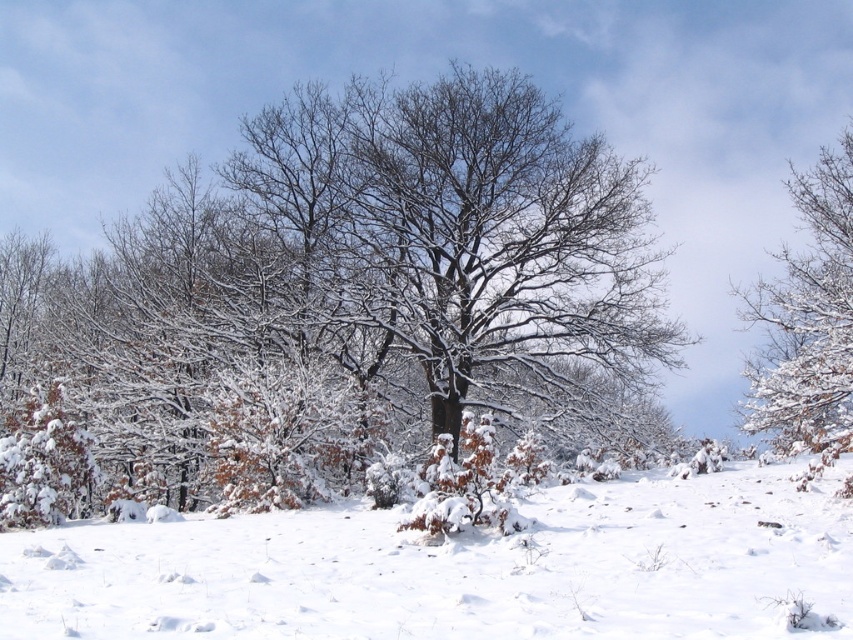
Is white fluffy snow at center positioned behind white snow-covered tree at right?

No, it is in front of white snow-covered tree at right.

Looking at this image, between white fluffy snow at center and white snow-covered tree at right, which one appears on the right side from the viewer's perspective?

white snow-covered tree at right is more to the right.

At what (x,y) coordinates should I click in order to perform the action: click on white fluffy snow at center. Please return your answer as a coordinate pair (x, y). Image resolution: width=853 pixels, height=640 pixels. Looking at the image, I should click on (457, 568).

Locate an element on the screen. The image size is (853, 640). white fluffy snow at center is located at coordinates (x=457, y=568).